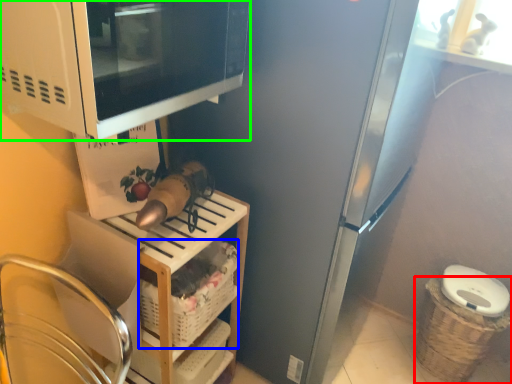
Question: Based on their relative distances, which object is farther from basket (highlighted by a red box)? Choose from basket (highlighted by a blue box) and microwave oven (highlighted by a green box).

Choices:
 (A) basket
 (B) microwave oven

Answer: (B)